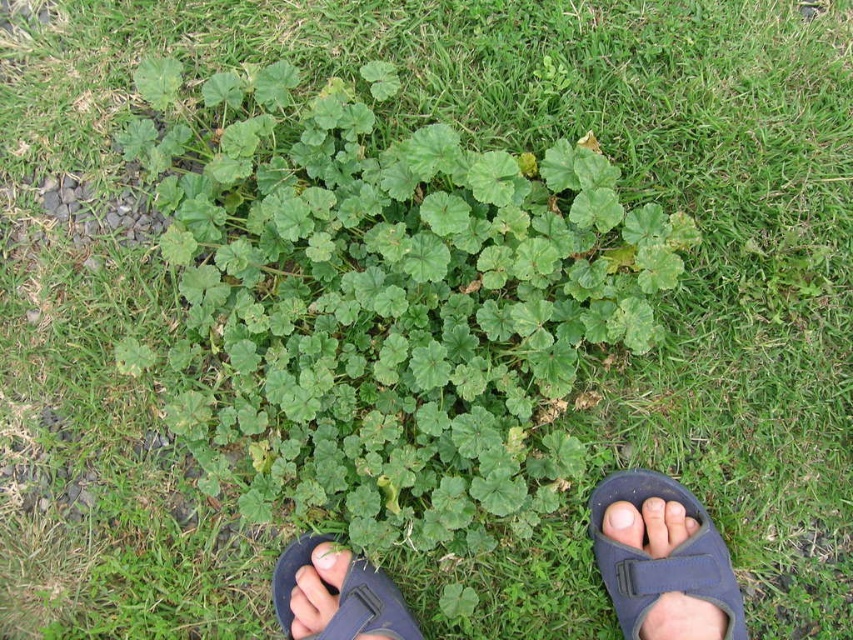
Question: Is green leafy plant at center to the right of pale skin toe at lower center from the viewer's perspective?

Choices:
 (A) yes
 (B) no

Answer: (B)

Question: Can you confirm if pink flesh at center is smaller than pale skin toe at lower center?

Choices:
 (A) yes
 (B) no

Answer: (B)

Question: Which object appears farthest from the camera in this image?

Choices:
 (A) pale skin toe at lower center
 (B) dark blue fabric sandal at lower right
 (C) dark blue fabric sandals at center

Answer: (A)

Question: Does dark blue fabric sandal at lower right appear over green leafy plant at center?

Choices:
 (A) yes
 (B) no

Answer: (A)

Question: Which point is farther from the camera taking this photo?

Choices:
 (A) (614, 548)
 (B) (349, 561)

Answer: (B)

Question: Which point is closer to the camera?

Choices:
 (A) pale skin toe at lower center
 (B) dark blue fabric sandal at lower right
 (C) black fabric sandal at lower center

Answer: (B)